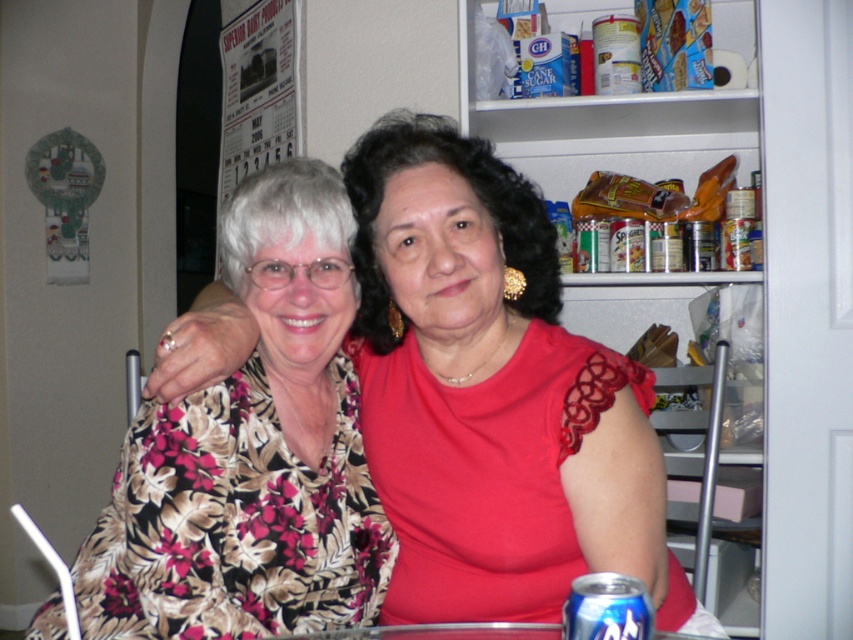
Measure the distance between floral fabric blouse at center and floral-patterned blouse at center.

floral fabric blouse at center and floral-patterned blouse at center are 5.33 inches apart from each other.

I want to click on floral fabric blouse at center, so click(492, 396).

In order to click on floral fabric blouse at center in this screenshot , I will do `click(492, 396)`.

Is point (352, 516) positioned in front of point (630, 608)?

That is False.

At what (x,y) coordinates should I click in order to perform the action: click on floral-patterned blouse at center. Please return your answer as a coordinate pair (x, y). Looking at the image, I should click on (253, 454).

The image size is (853, 640). What are the coordinates of `floral-patterned blouse at center` in the screenshot? It's located at (253, 454).

Between floral fabric blouse at center and blue metallic can at lower center, which one is positioned higher?

floral fabric blouse at center is above.

From the picture: Is floral fabric blouse at center above blue metallic can at lower center?

Yes, floral fabric blouse at center is above blue metallic can at lower center.

Describe the element at coordinates (492, 396) in the screenshot. This screenshot has height=640, width=853. I see `floral fabric blouse at center` at that location.

Locate an element on the screen. This screenshot has width=853, height=640. floral fabric blouse at center is located at coordinates (492, 396).